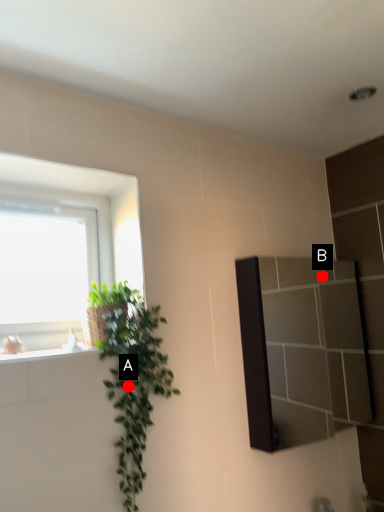
Question: Two points are circled on the image, labeled by A and B beside each circle. Which point is closer to the camera taking this photo?

Choices:
 (A) A is closer
 (B) B is closer

Answer: (A)